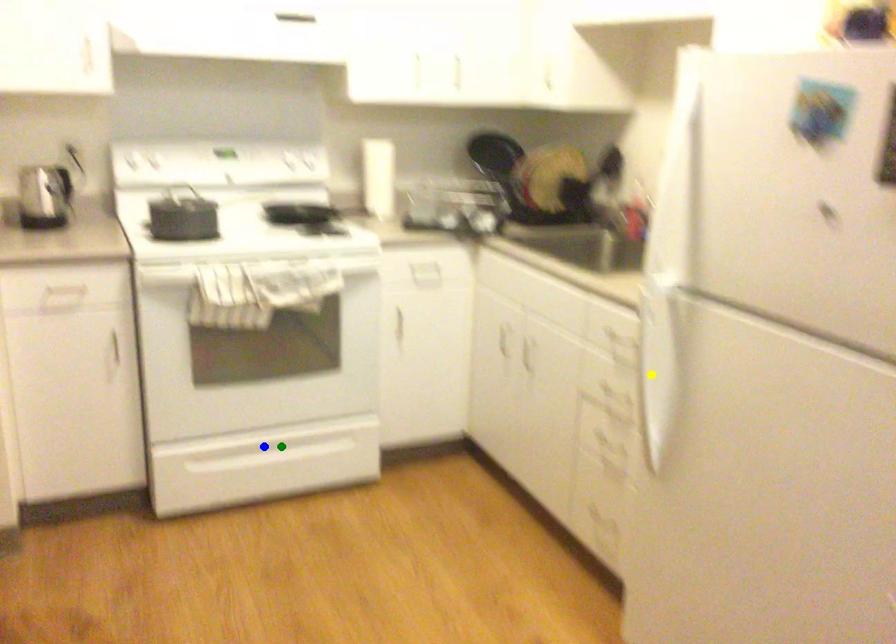
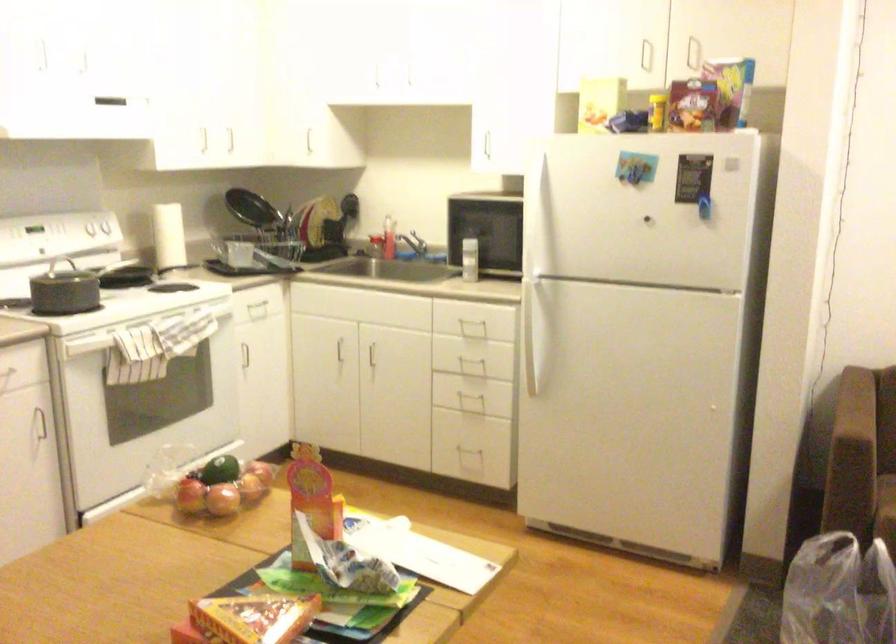
I am providing you with two images of the same scene from different viewpoints. Three points are marked in image1. Which point corresponds to a part or object that is occluded in image2?In image1, three points are marked. Which of them correspond to a part or object that is occluded in image2?Among the three points shown in image1, which one corresponds to a part or object that is no longer visible due to occlusion in image2?

blue point, green point